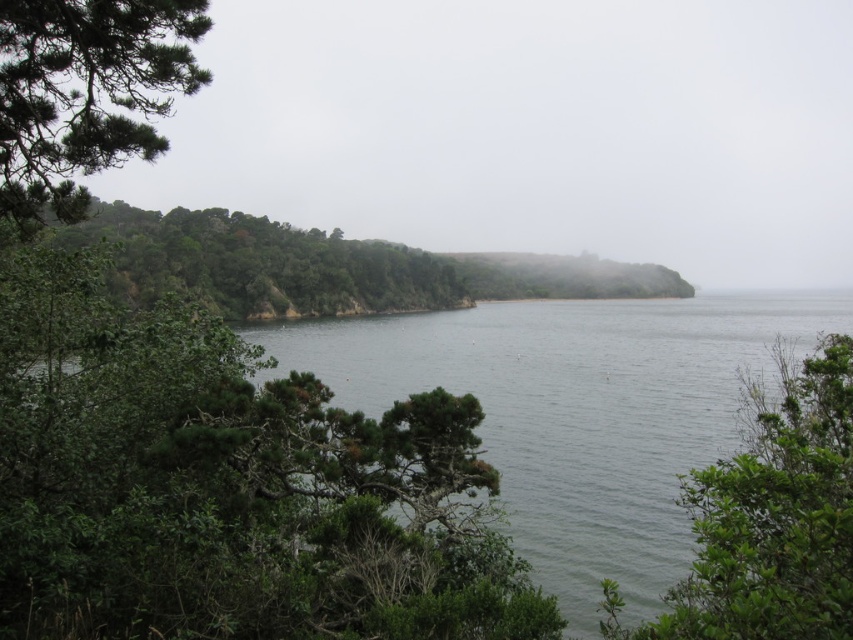
Who is taller, green matte tree at upper left or green leafy trees at left?

With more height is green leafy trees at left.

Which is in front, point (18, 227) or point (297, 285)?

Point (18, 227) is in front.

Is point (82, 186) more distant than point (241, 317)?

That is False.

I want to click on green matte tree at upper left, so click(86, 93).

Measure the distance between point [822,540] and camera.

Point [822,540] and camera are 3.26 meters apart.

Identify the location of green leafy tree at lower right. This screenshot has height=640, width=853. (770, 518).

Which is in front, point (94, 396) or point (49, 132)?

Positioned in front is point (49, 132).

Who is positioned more to the right, green leafy tree at center-left or green matte tree at upper left?

From the viewer's perspective, green leafy tree at center-left appears more on the right side.

Find the location of `green leafy tree at center-left`. green leafy tree at center-left is located at coordinates (225, 486).

Where is `green leafy tree at center-left`? The image size is (853, 640). green leafy tree at center-left is located at coordinates (225, 486).